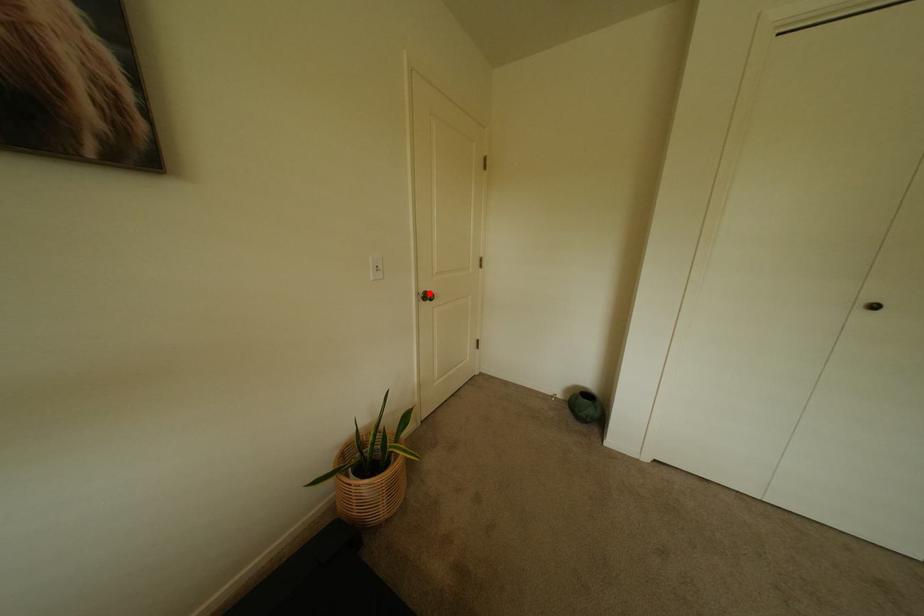
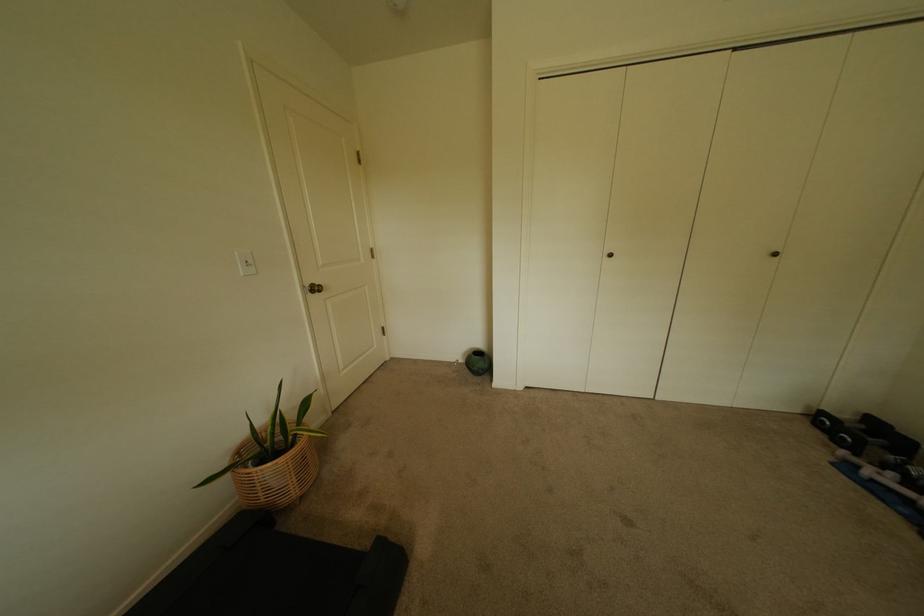
The point at the highlighted location is marked in the first image. Where is the corresponding point in the second image?

(315, 286)